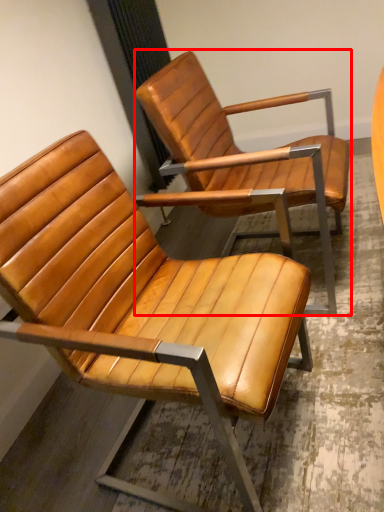
Question: In this image, where is chair (annotated by the red box) located relative to chair?

Choices:
 (A) right
 (B) left

Answer: (A)